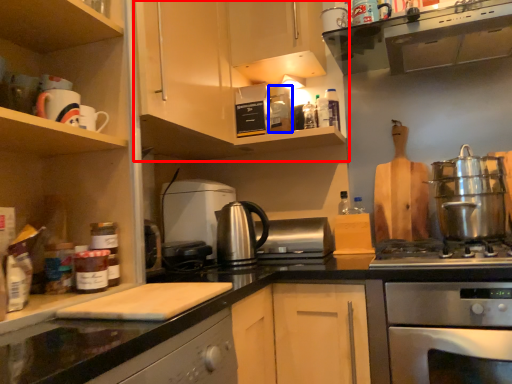
Question: Which point is closer to the camera, cabinetry (highlighted by a red box) or appliance (highlighted by a blue box)?

Choices:
 (A) cabinetry
 (B) appliance

Answer: (A)